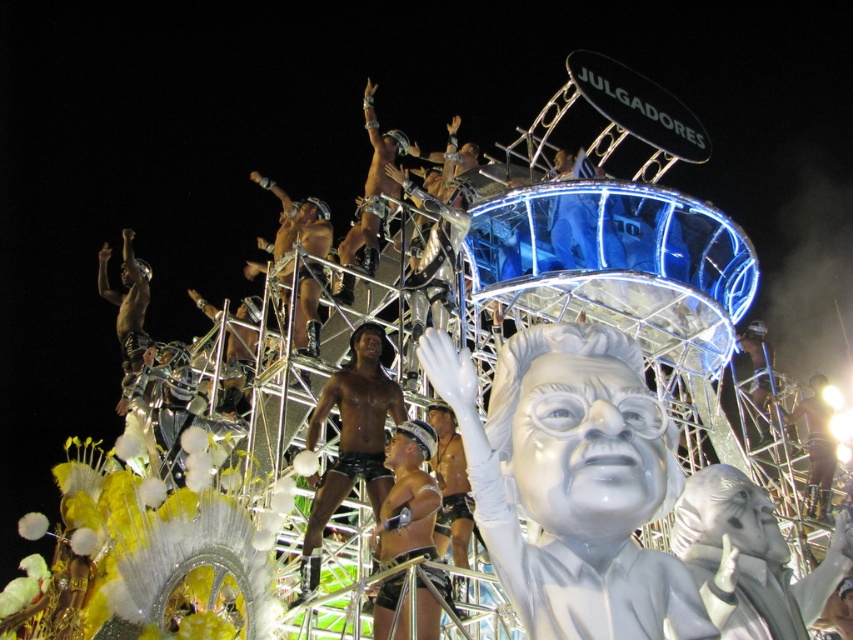
Is white glossy statue at center smaller than shiny black shorts at center?

Correct, white glossy statue at center occupies less space than shiny black shorts at center.

Does white glossy statue at center have a lesser height compared to shiny black shorts at center?

Yes, white glossy statue at center is shorter than shiny black shorts at center.

The width and height of the screenshot is (853, 640). What do you see at coordinates (572, 481) in the screenshot?
I see `white glossy statue at center` at bounding box center [572, 481].

Where is `white glossy statue at center`? white glossy statue at center is located at coordinates (572, 481).

Does point (375, 488) come closer to viewer compared to point (436, 440)?

Yes, it is.

Based on the photo, who is higher up, shiny black shorts at center or shiny silver shorts at center?

shiny black shorts at center is higher up.

Who is more forward, (328,497) or (421,600)?

Positioned in front is point (421,600).

Find the location of a particular element. shiny black shorts at center is located at coordinates (351, 440).

Does white glossy statue at center have a lesser width compared to shiny silver shorts at center?

Incorrect, white glossy statue at center's width is not less than shiny silver shorts at center's.

Is white glossy statue at center smaller than shiny silver shorts at center?

Incorrect, white glossy statue at center is not smaller in size than shiny silver shorts at center.

Which is behind, point (691, 609) or point (374, 609)?

Point (374, 609)

Find the location of `white glossy statue at center`. white glossy statue at center is located at coordinates (572, 481).